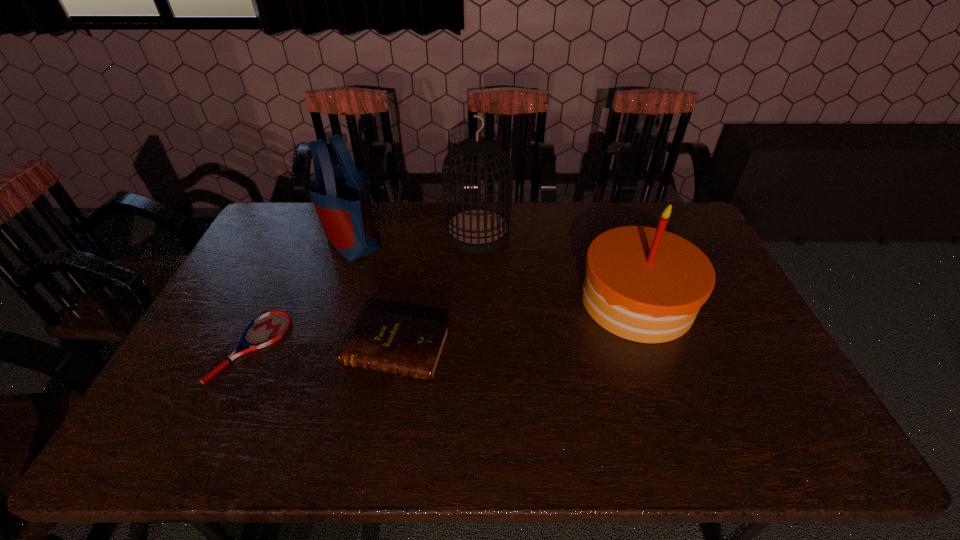
Identify which object is the third nearest to the fourth tallest object. Please provide its 2D coordinates. Your answer should be formatted as a tuple, i.e. [(x, y)], where the tuple contains the x and y coordinates of a point satisfying the conditions above.

[(479, 230)]

Where is `vacant area that satisfies the following two spatial constraints: 1. on the back side of the shortest object; 2. on the left side of the rightmost object`? Image resolution: width=960 pixels, height=540 pixels. vacant area that satisfies the following two spatial constraints: 1. on the back side of the shortest object; 2. on the left side of the rightmost object is located at coordinates [x=273, y=301].

Identify the location of free spot that satisfies the following two spatial constraints: 1. on the back side of the birdcage; 2. on the right side of the handbag. This screenshot has height=540, width=960. (352, 234).